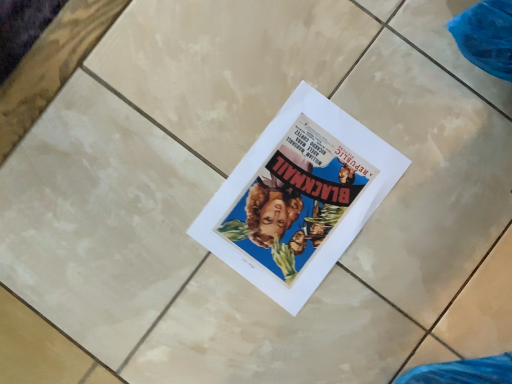
Find the location of a particular element. The image size is (512, 384). matte paper poster at center is located at coordinates (298, 198).

This screenshot has height=384, width=512. Describe the element at coordinates (298, 198) in the screenshot. I see `matte paper poster at center` at that location.

Identify the location of matte paper poster at center. (298, 198).